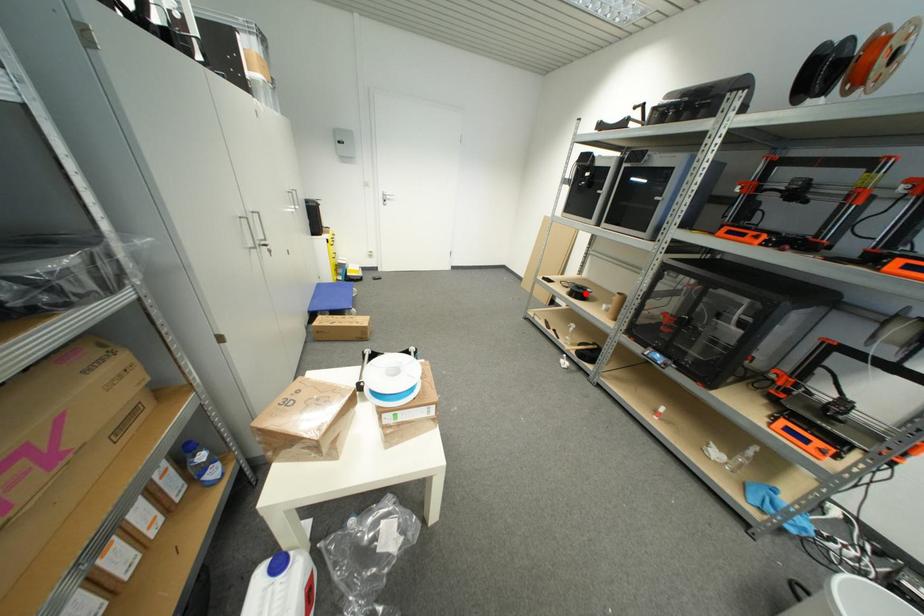
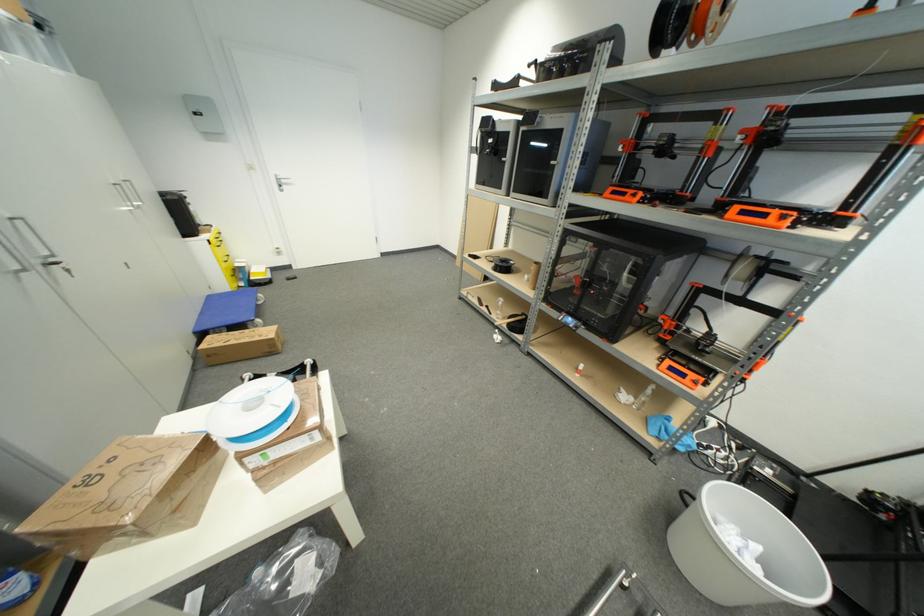
The point at the highlighted location is marked in the first image. Where is the corresponding point in the second image?

(508, 267)